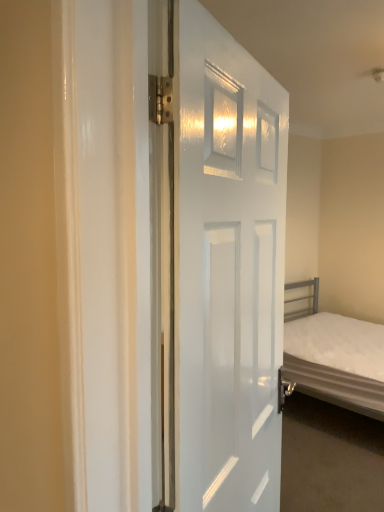
At what (x,y) coordinates should I click in order to perform the action: click on white glossy door at center. Please return your answer as a coordinate pair (x, y). The width and height of the screenshot is (384, 512). Looking at the image, I should click on (218, 262).

What do you see at coordinates (218, 262) in the screenshot? I see `white glossy door at center` at bounding box center [218, 262].

What do you see at coordinates (334, 356) in the screenshot? The image size is (384, 512). I see `white fabric bed at right` at bounding box center [334, 356].

At what (x,y) coordinates should I click in order to perform the action: click on white fabric bed at right. Please return your answer as a coordinate pair (x, y). Image resolution: width=384 pixels, height=512 pixels. Looking at the image, I should click on (334, 356).

The image size is (384, 512). Find the location of `white glossy door at center`. white glossy door at center is located at coordinates (218, 262).

Would you say white fabric bed at right is to the left or to the right of white glossy door at center in the picture?

Clearly, white fabric bed at right is on the right of white glossy door at center in the image.

Considering their positions, is white fabric bed at right located in front of or behind white glossy door at center?

In the image, white fabric bed at right appears behind white glossy door at center.

Which is farther from the camera, (362,364) or (206,114)?

The point (362,364) is farther from the camera.

From the image's perspective, is white fabric bed at right over white glossy door at center?

No, from the image's perspective, white fabric bed at right is not over white glossy door at center.

In the scene shown: From a real-world perspective, between white fabric bed at right and white glossy door at center, who is vertically lower?

white fabric bed at right.

Considering the sizes of objects white fabric bed at right and white glossy door at center in the image provided, who is thinner, white fabric bed at right or white glossy door at center?

With smaller width is white glossy door at center.

Who is shorter, white fabric bed at right or white glossy door at center?

white fabric bed at right is shorter.

Does white fabric bed at right have a larger size compared to white glossy door at center?

Correct, white fabric bed at right is larger in size than white glossy door at center.

Is white glossy door at center completely or partially inside white fabric bed at right?

That's incorrect, white glossy door at center is not inside white fabric bed at right.

Is white fabric bed at right beside white glossy door at center?

There is a gap between white fabric bed at right and white glossy door at center.

From the picture: Could you tell me if white fabric bed at right is turned towards white glossy door at center?

No, white fabric bed at right is not turned towards white glossy door at center.

Where is `door above the white fabric bed at right (from a real-world perspective)`? door above the white fabric bed at right (from a real-world perspective) is located at coordinates (218, 262).

Is white glossy door at center to the left or to the right of white fabric bed at right in the image?

Based on their positions, white glossy door at center is located to the left of white fabric bed at right.

In the image, is white glossy door at center positioned in front of or behind white fabric bed at right?

white glossy door at center is positioned closer to the viewer than white fabric bed at right.

Is point (175, 215) farther from viewer compared to point (377, 380)?

No, it is in front of (377, 380).

From the image's perspective, which is above, white glossy door at center or white fabric bed at right?

white glossy door at center, from the image's perspective.

From a real-world perspective, which object stands above the other?

white glossy door at center.

Can you confirm if white glossy door at center is thinner than white fabric bed at right?

Correct, the width of white glossy door at center is less than that of white fabric bed at right.

Considering the relative sizes of white glossy door at center and white fabric bed at right in the image provided, is white glossy door at center taller than white fabric bed at right?

Indeed, white glossy door at center has a greater height compared to white fabric bed at right.

Considering the sizes of objects white glossy door at center and white fabric bed at right in the image provided, who is bigger, white glossy door at center or white fabric bed at right?

white fabric bed at right.

Can we say white glossy door at center lies outside white fabric bed at right?

Yes, white glossy door at center is not within white fabric bed at right.

In the scene shown: Is white glossy door at center touching white fabric bed at right?

No.

Is white glossy door at center positioned with its back to white fabric bed at right?

No, white glossy door at center is not facing away from white fabric bed at right.

How different are the orientations of white glossy door at center and white fabric bed at right in degrees?

They differ by 19.5 degrees in their facing directions.

Locate an element on the screen. The width and height of the screenshot is (384, 512). door above the white fabric bed at right (from a real-world perspective) is located at coordinates (218, 262).

Identify the location of door above the white fabric bed at right (from a real-world perspective). (218, 262).

Where is `door that appears on the left of white fabric bed at right`? This screenshot has width=384, height=512. door that appears on the left of white fabric bed at right is located at coordinates (218, 262).